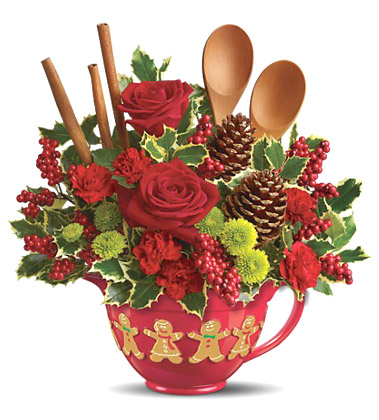
In order to click on vase in this screenshot , I will do `click(201, 384)`.